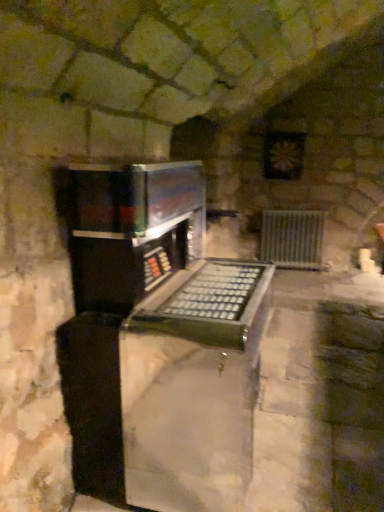
Question: From a real-world perspective, is metallic silver radiator at center right above or below metallic black keyboard at center?

Choices:
 (A) above
 (B) below

Answer: (B)

Question: Is metallic silver radiator at center right to the left or to the right of metallic black keyboard at center in the image?

Choices:
 (A) right
 (B) left

Answer: (A)

Question: In terms of width, does metallic silver radiator at center right look wider or thinner when compared to metallic black keyboard at center?

Choices:
 (A) wide
 (B) thin

Answer: (B)

Question: Does point (119, 178) appear closer or farther from the camera than point (264, 223)?

Choices:
 (A) closer
 (B) farther

Answer: (A)

Question: From a real-world perspective, relative to metallic silver radiator at center right, is metallic black keyboard at center vertically above or below?

Choices:
 (A) above
 (B) below

Answer: (A)

Question: In the image, is metallic black keyboard at center on the left side or the right side of metallic silver radiator at center right?

Choices:
 (A) right
 (B) left

Answer: (B)

Question: In the image, is metallic black keyboard at center positioned in front of or behind metallic silver radiator at center right?

Choices:
 (A) behind
 (B) front

Answer: (B)